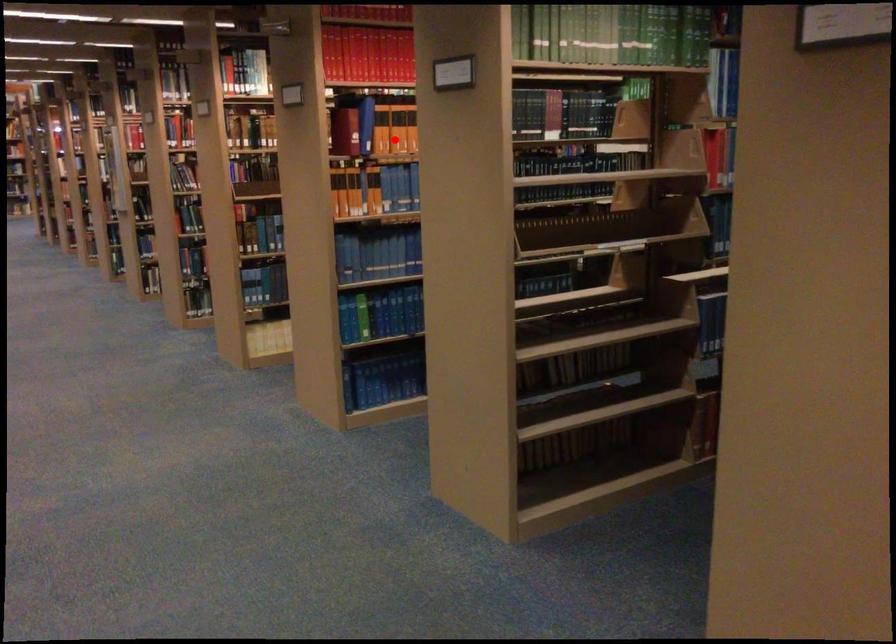
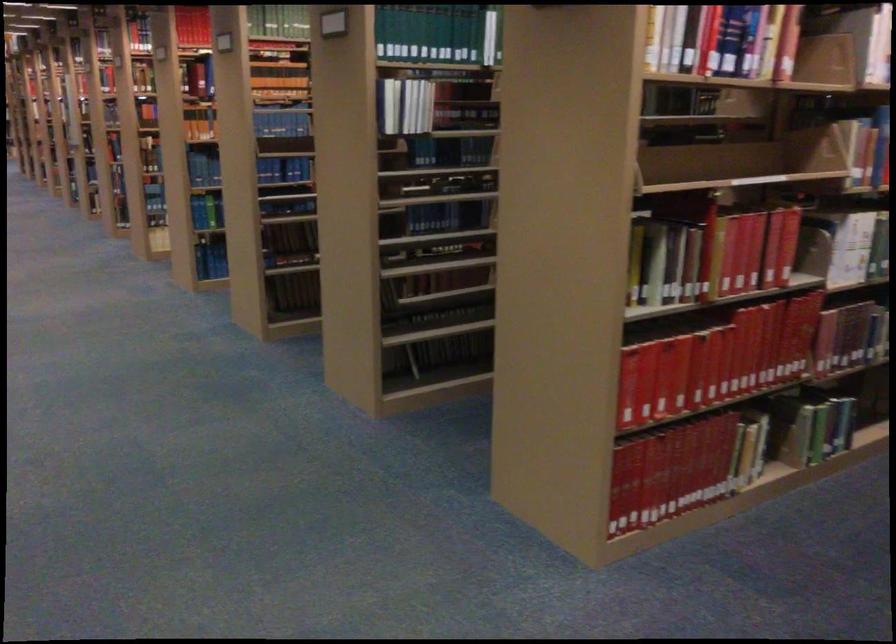
Question: I am providing you with two images of the same scene from different viewpoints. A red point is marked on the first image. At the location where the point appears in image 1, is it still visible in image 2?

Choices:
 (A) Yes
 (B) No

Answer: (B)